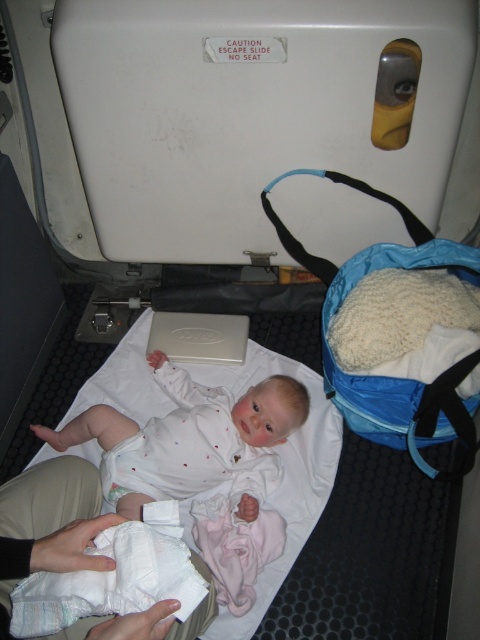
You are a flight attendant checking the emergency exit area. You see the white soft baby at center and the white soft diaper at lower left. Which object takes up more space in the image?

The white soft baby at center is larger in size than the white soft diaper at lower left, so it takes up more space in the image.

You are a flight attendant checking the emergency exit area. You see the white soft baby at center and the white soft diaper at lower left. Which item is more to the right?

The white soft baby at center is more to the right than the white soft diaper at lower left.